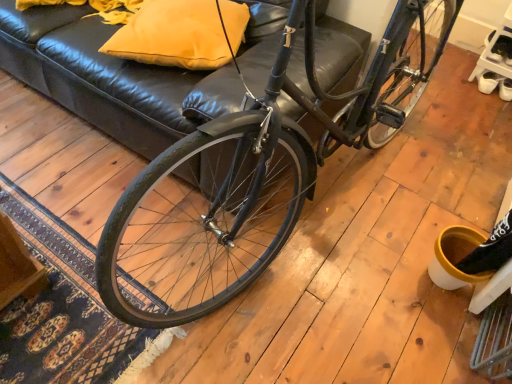
Question: In the image, is shiny black bicycle at center on the left side or the right side of matte yellow pillow at upper center?

Choices:
 (A) right
 (B) left

Answer: (A)

Question: Looking at their shapes, would you say shiny black bicycle at center is wider or thinner than matte yellow pillow at upper center?

Choices:
 (A) thin
 (B) wide

Answer: (B)

Question: Choose the correct answer: Is shiny black bicycle at center inside matte yellow pillow at upper center or outside it?

Choices:
 (A) inside
 (B) outside

Answer: (B)

Question: Does point (228, 13) appear closer or farther from the camera than point (132, 251)?

Choices:
 (A) farther
 (B) closer

Answer: (A)

Question: Is matte yellow pillow at upper center in front of or behind shiny black bicycle at center in the image?

Choices:
 (A) front
 (B) behind

Answer: (B)

Question: Is matte yellow pillow at upper center wider or thinner than shiny black bicycle at center?

Choices:
 (A) thin
 (B) wide

Answer: (A)

Question: From the image's perspective, is matte yellow pillow at upper center above or below shiny black bicycle at center?

Choices:
 (A) below
 (B) above

Answer: (B)